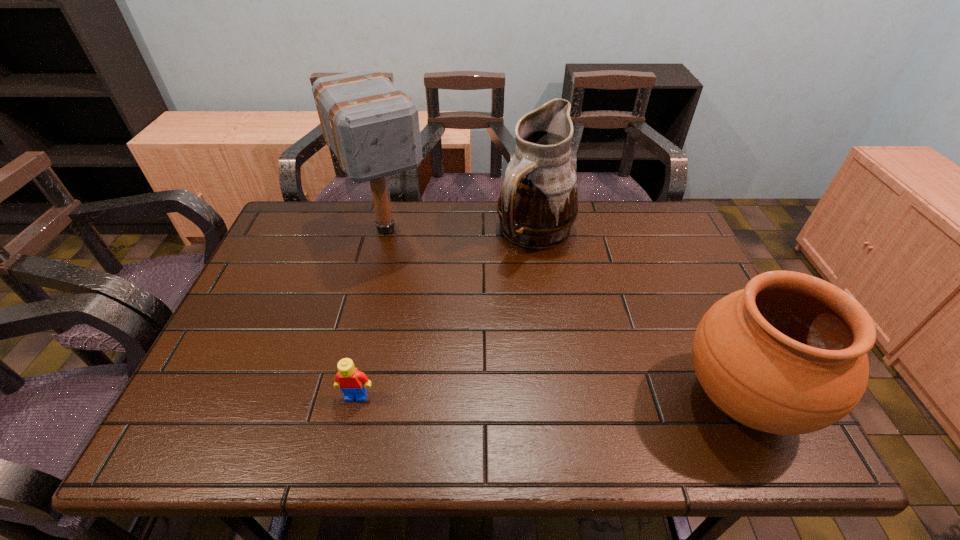
This screenshot has width=960, height=540. What are the coordinates of `free space at the near edge of the desktop` in the screenshot? It's located at (471, 400).

In the image, there is a desktop. At what (x,y) coordinates should I click in order to perform the action: click on vacant space at the left edge. Please return your answer as a coordinate pair (x, y). Looking at the image, I should click on (272, 299).

The width and height of the screenshot is (960, 540). Identify the location of vacant space at the right edge. (663, 271).

Find the location of a particular element. free space between the Lego and the mallet is located at coordinates (372, 313).

Image resolution: width=960 pixels, height=540 pixels. In order to click on free space between the mallet and the third shortest object in this screenshot , I will do `click(461, 231)`.

Find the location of `vacant area that lies between the shortest object and the third object from left to right`. vacant area that lies between the shortest object and the third object from left to right is located at coordinates (445, 315).

Find the location of a particular element. The height and width of the screenshot is (540, 960). free area in between the mallet and the pottery is located at coordinates (564, 314).

At what (x,y) coordinates should I click in order to perform the action: click on unoccupied position between the shortest object and the mallet. Please return your answer as a coordinate pair (x, y). The width and height of the screenshot is (960, 540). Looking at the image, I should click on (372, 313).

The height and width of the screenshot is (540, 960). I want to click on free space between the rightmost object and the second object from right to left, so click(638, 316).

The width and height of the screenshot is (960, 540). Identify the location of free space between the third shortest object and the mallet. (461, 231).